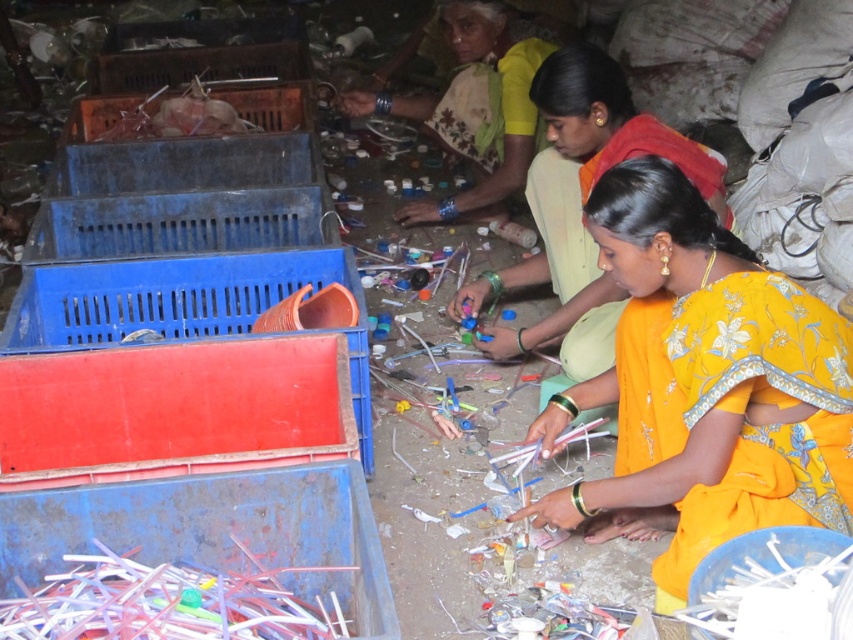
Question: Which object appears closest to the camera in this image?

Choices:
 (A) yellow embroidered saree at center
 (B) red plastic crate at lower left
 (C) green floral sari at center
 (D) yellow embroidered sari at center

Answer: (D)

Question: Which of the following is the farthest from the observer?

Choices:
 (A) (357, 362)
 (B) (610, 285)
 (C) (476, 88)

Answer: (C)

Question: Does red plastic crate at lower left appear on the left side of green floral sari at center?

Choices:
 (A) yes
 (B) no

Answer: (A)

Question: Can you confirm if red plastic crate at lower left is positioned to the right of green floral sari at center?

Choices:
 (A) no
 (B) yes

Answer: (A)

Question: Is yellow embroidered sari at center thinner than yellow embroidered saree at center?

Choices:
 (A) yes
 (B) no

Answer: (A)

Question: Which of the following is the closest to the observer?

Choices:
 (A) (28, 307)
 (B) (482, 65)
 (C) (643, 193)

Answer: (C)